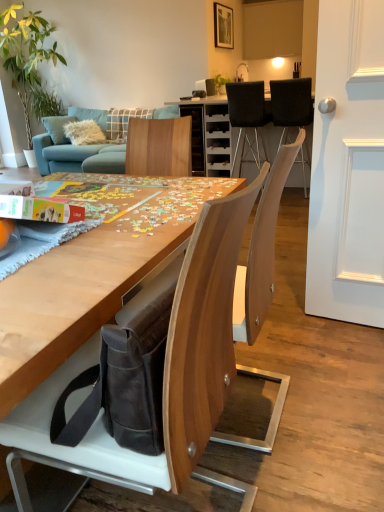
Question: Is teal fabric couch at upper left located outside wooden chair at center, acting as the first chair starting from the left?

Choices:
 (A) yes
 (B) no

Answer: (A)

Question: From a real-world perspective, is teal fabric couch at upper left on wooden chair at center, which ranks as the 1th chair in bottom-to-top order?

Choices:
 (A) no
 (B) yes

Answer: (A)

Question: Does teal fabric couch at upper left have a greater width compared to wooden chair at center, acting as the first chair starting from the left?

Choices:
 (A) yes
 (B) no

Answer: (A)

Question: Does teal fabric couch at upper left appear on the left side of wooden chair at center, which ranks as the 1th chair in bottom-to-top order?

Choices:
 (A) no
 (B) yes

Answer: (B)

Question: Is teal fabric couch at upper left oriented towards wooden chair at center, the third chair positioned from the top?

Choices:
 (A) no
 (B) yes

Answer: (B)

Question: Based on their positions, is black fabric chair at upper center, which ranks as the 3th chair in front-to-back order, located to the left or right of wooden chair at center, which ranks as the first chair in front-to-back order?

Choices:
 (A) right
 (B) left

Answer: (A)

Question: Would you say black fabric chair at upper center, marked as the 2th chair in a right-to-left arrangement, is inside or outside wooden chair at center, which ranks as the first chair in front-to-back order?

Choices:
 (A) outside
 (B) inside

Answer: (A)

Question: Considering their positions, is black fabric chair at upper center, the 1th chair in the back-to-front sequence, located in front of or behind wooden chair at center, which is the third chair from back to front?

Choices:
 (A) front
 (B) behind

Answer: (B)

Question: Does point (235, 156) appear closer or farther from the camera than point (162, 381)?

Choices:
 (A) farther
 (B) closer

Answer: (A)

Question: Is black fabric chair at upper right, positioned as the 1th chair in top-to-bottom order, situated inside teal fabric couch at upper left or outside?

Choices:
 (A) inside
 (B) outside

Answer: (B)

Question: Is black fabric chair at upper right, which appears as the 3th chair when viewed from the left, taller or shorter than teal fabric couch at upper left?

Choices:
 (A) tall
 (B) short

Answer: (B)

Question: From a real-world perspective, relative to teal fabric couch at upper left, is black fabric chair at upper right, which appears as the 3th chair when viewed from the left, vertically above or below?

Choices:
 (A) below
 (B) above

Answer: (B)

Question: Considering the positions of black fabric chair at upper right, the second chair when ordered from front to back, and teal fabric couch at upper left in the image, is black fabric chair at upper right, the second chair when ordered from front to back, wider or thinner than teal fabric couch at upper left?

Choices:
 (A) thin
 (B) wide

Answer: (A)

Question: Does point (284, 110) appear closer or farther from the camera than point (49, 48)?

Choices:
 (A) closer
 (B) farther

Answer: (A)

Question: In terms of size, does black fabric chair at upper right, which appears as the 3th chair when viewed from the left, appear bigger or smaller than green leafy plant at upper left?

Choices:
 (A) small
 (B) big

Answer: (A)